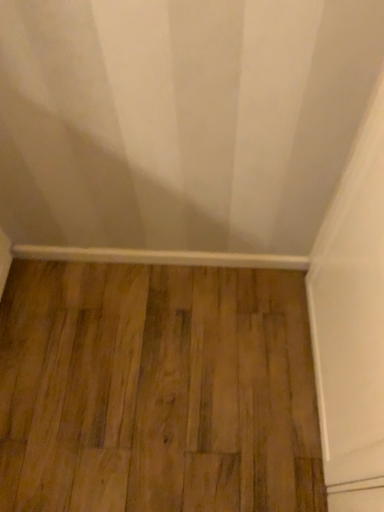
You are a GUI agent. You are given a task and a screenshot of the screen. Output one action in this format:
    pyautogui.click(x=<x>, y=<y>)
    Task: Click on the free space to the left of white smooth baseboard at bottom
    The width and height of the screenshot is (384, 512).
    Given the screenshot: What is the action you would take?
    pyautogui.click(x=72, y=302)